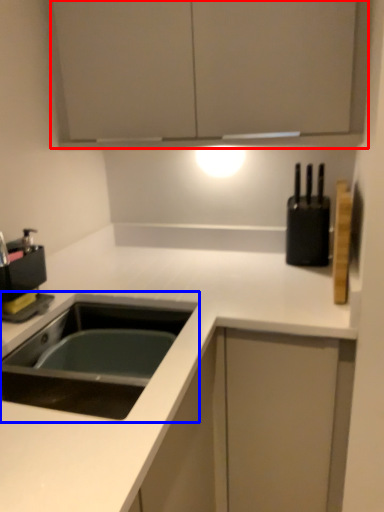
Question: Which object appears closest to the camera in this image, cabinetry (highlighted by a red box) or sink (highlighted by a blue box)?

Choices:
 (A) cabinetry
 (B) sink

Answer: (B)